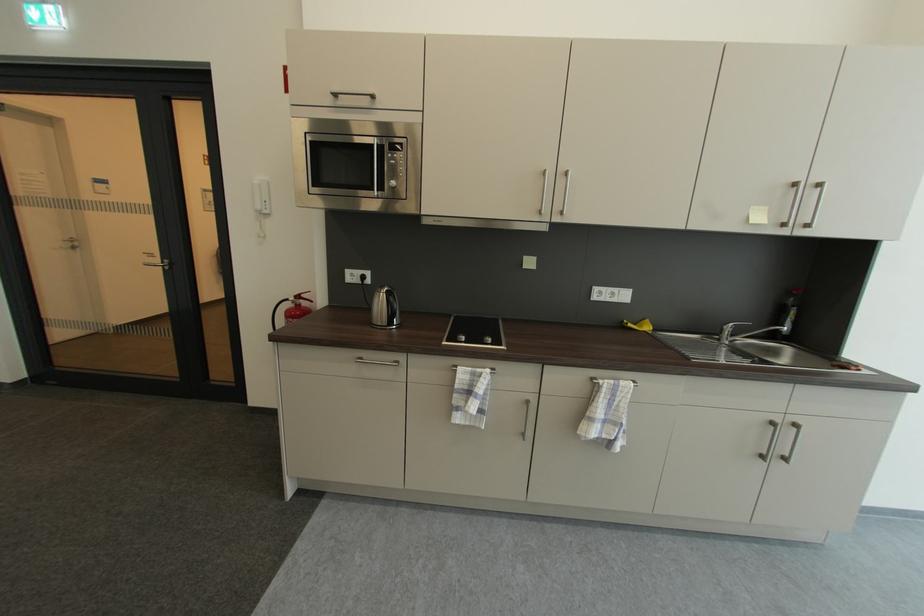
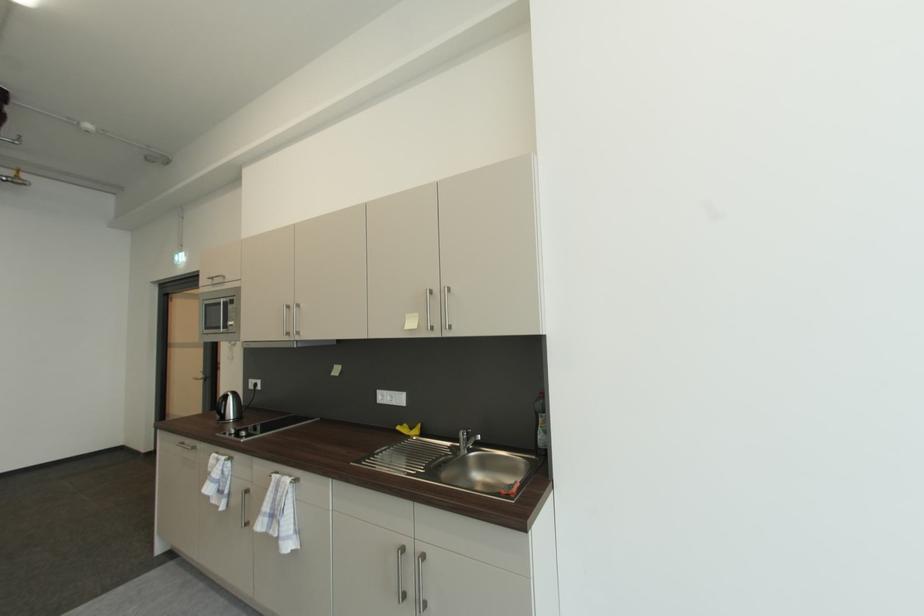
Find the pixel in the second image that matches (x=397, y=301) in the first image.

(227, 402)